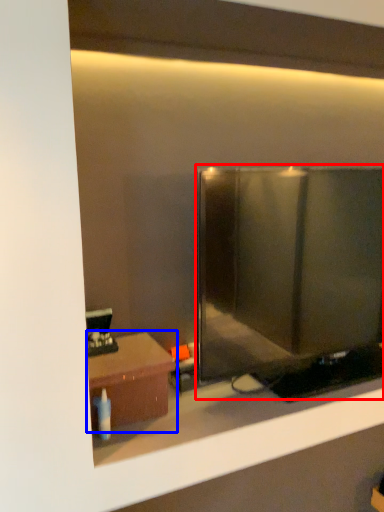
Question: Which point is closer to the camera, glass door (highlighted by a red box) or table (highlighted by a blue box)?

Choices:
 (A) glass door
 (B) table

Answer: (A)